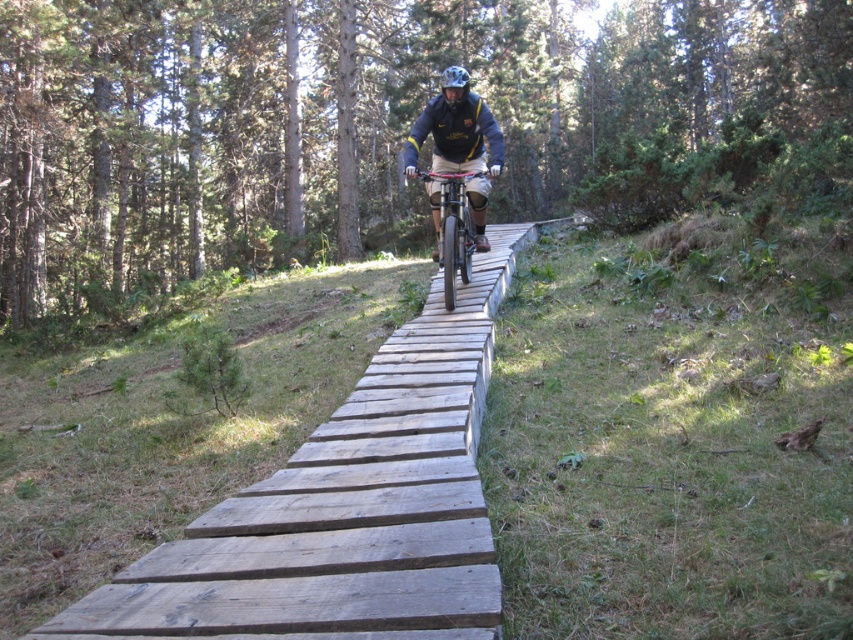
You are a cyclist trying to balance on a narrow wooden trail. You notice the matte black bicycle at center and the matte white helmet at center. Which object is positioned lower from the ground?

The matte black bicycle at center is located below the matte white helmet at center, so the matte black bicycle at center is positioned lower from the ground.

You are a cyclist on a narrow wooden trail. You notice the weathered wood planks at center and the matte white helmet at center. Which object is larger in the image?

The matte white helmet at center is larger than the weathered wood planks at center.

You are standing on the wooden plank trail and see two points marked on the trail. The first point is at coordinate point (322, 596) and the second point is at coordinate point (453, 88). Which point is closer to you?

Point (322, 596) is closer to you than point (453, 88).